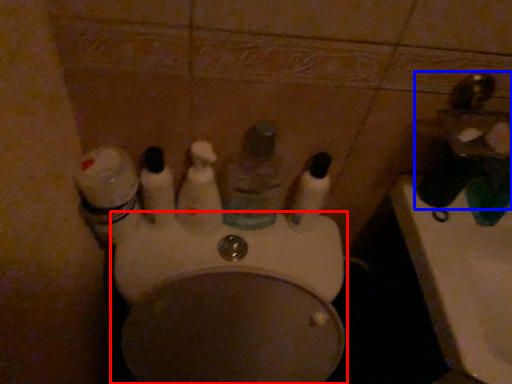
Question: Which object is closer to the camera taking this photo, toilet (highlighted by a red box) or faucet (highlighted by a blue box)?

Choices:
 (A) toilet
 (B) faucet

Answer: (A)